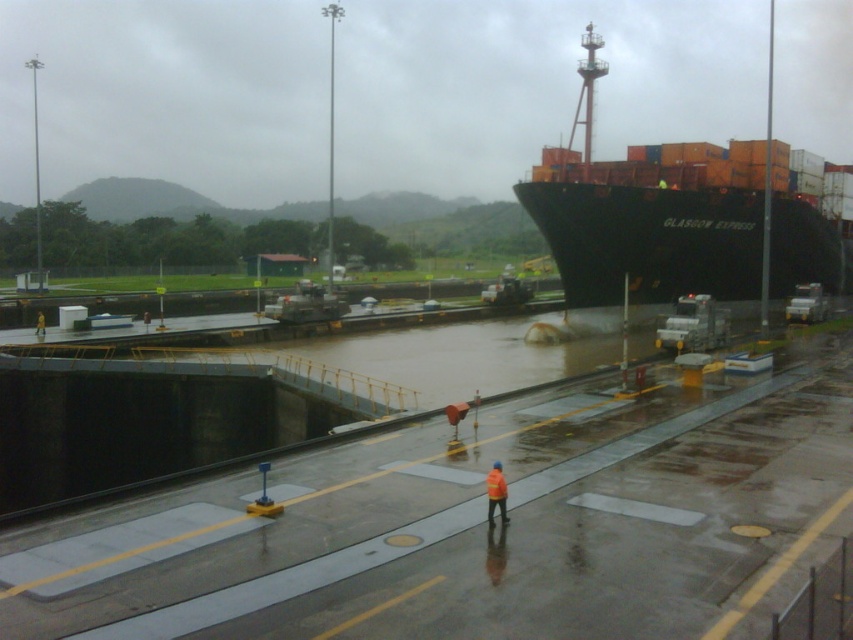
Between point (693, 168) and point (502, 509), which one is positioned in front?

Point (502, 509) is more forward.

Can you confirm if black matte container ship at upper right is positioned below orange reflective jacket at center?

Incorrect, black matte container ship at upper right is not positioned below orange reflective jacket at center.

This screenshot has height=640, width=853. What do you see at coordinates (677, 218) in the screenshot?
I see `black matte container ship at upper right` at bounding box center [677, 218].

Image resolution: width=853 pixels, height=640 pixels. I want to click on black matte container ship at upper right, so click(x=677, y=218).